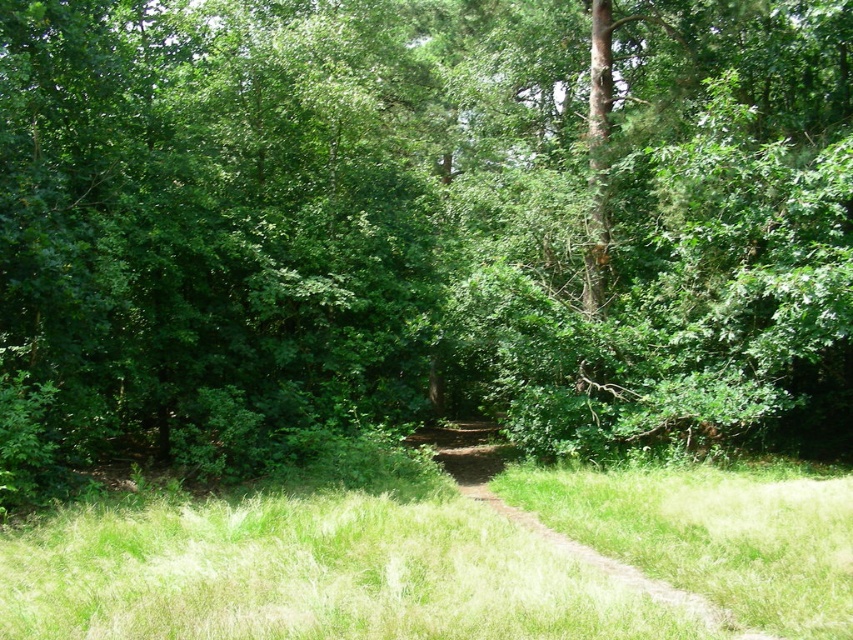
Question: Which point is closer to the camera taking this photo?

Choices:
 (A) (619, 568)
 (B) (233, 499)

Answer: (A)

Question: Is green grass at center to the left of brown dirt track at center from the viewer's perspective?

Choices:
 (A) no
 (B) yes

Answer: (A)

Question: Can you confirm if green grass at center is wider than brown dirt track at center?

Choices:
 (A) no
 (B) yes

Answer: (B)

Question: Which point is closer to the camera taking this photo?

Choices:
 (A) (434, 429)
 (B) (143, 616)

Answer: (B)

Question: Is green grass at center to the right of brown dirt track at center from the viewer's perspective?

Choices:
 (A) yes
 (B) no

Answer: (A)